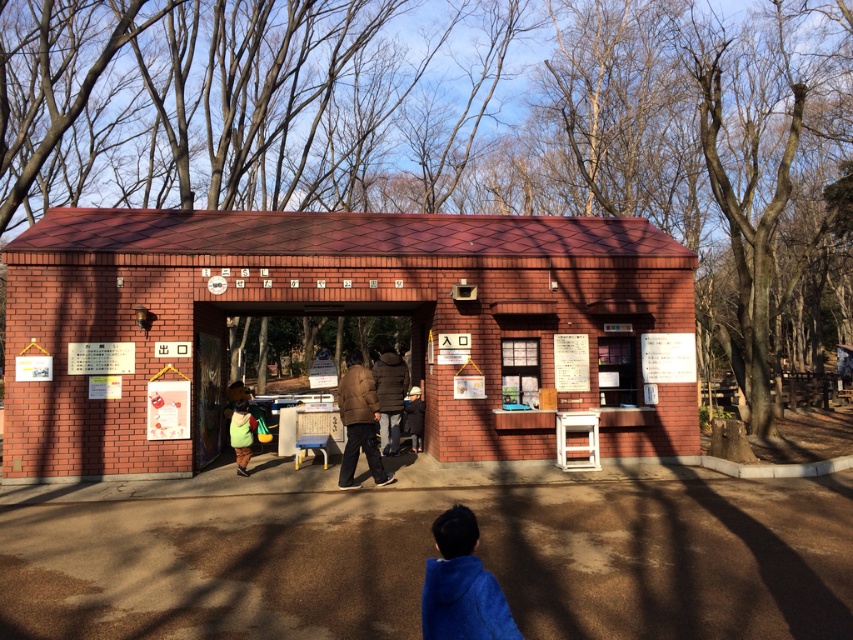
Who is more distant from viewer, [479,595] or [386,401]?

Point [386,401]

Where is `blue fleece jacket at lower center`? blue fleece jacket at lower center is located at coordinates (461, 586).

Is point (497, 605) farther from viewer compared to point (380, 416)?

No.

Where is `blue fleece jacket at lower center`? Image resolution: width=853 pixels, height=640 pixels. blue fleece jacket at lower center is located at coordinates pyautogui.click(x=461, y=586).

Can you confirm if dark brown fur coat at center is positioned below green fabric backpack at center?

Incorrect, dark brown fur coat at center is not positioned below green fabric backpack at center.

Who is positioned more to the right, dark brown fur coat at center or green fabric backpack at center?

From the viewer's perspective, dark brown fur coat at center appears more on the right side.

What do you see at coordinates (390, 397) in the screenshot? I see `dark brown fur coat at center` at bounding box center [390, 397].

At what (x,y) coordinates should I click in order to perform the action: click on dark brown fur coat at center. Please return your answer as a coordinate pair (x, y). The image size is (853, 640). Looking at the image, I should click on (390, 397).

Is red brick hut at center taller than brown fuzzy coat at center?

Yes, red brick hut at center is taller than brown fuzzy coat at center.

Is point (9, 292) closer to camera compared to point (375, 397)?

No, it is not.

Identify the location of red brick hut at center. The height and width of the screenshot is (640, 853). (335, 314).